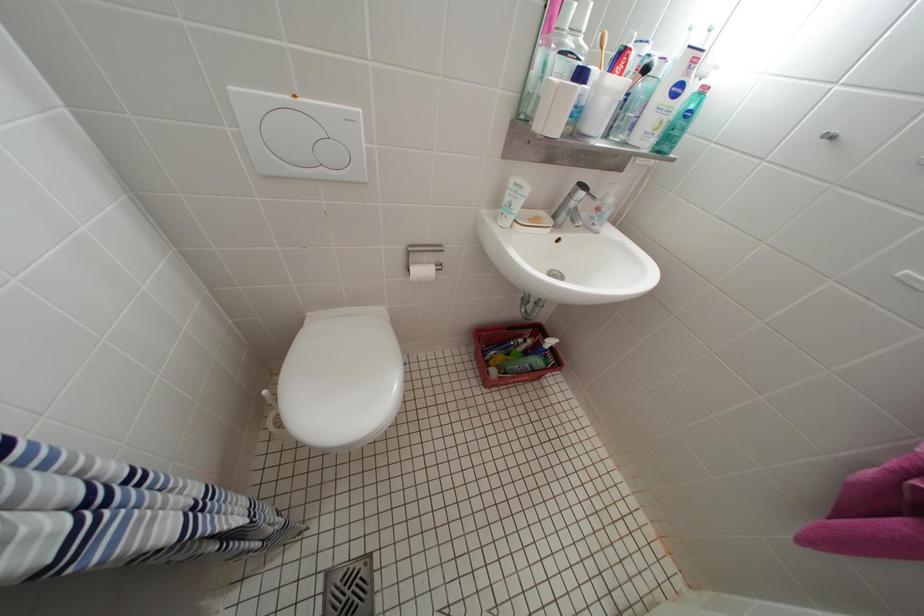
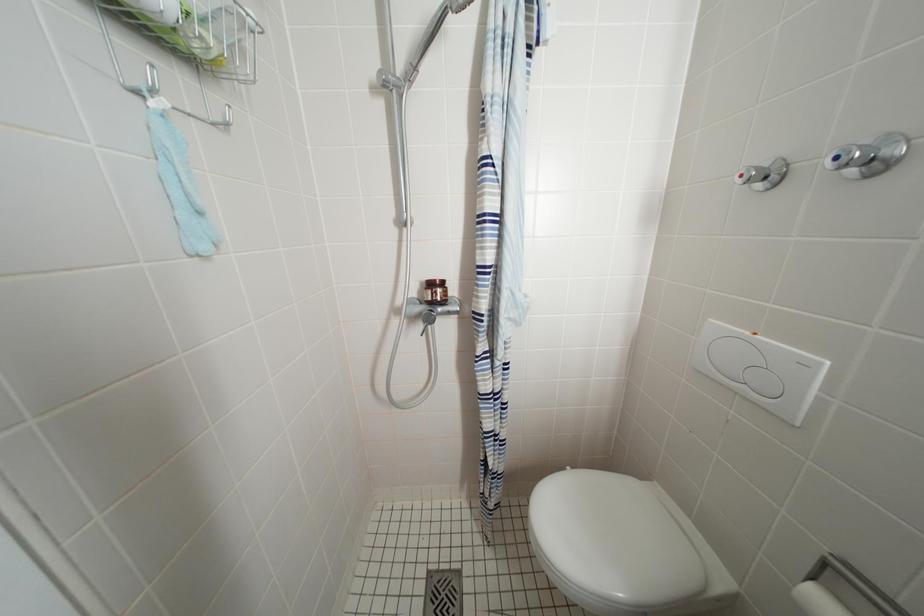
The first image is from the beginning of the video and the second image is from the end. How did the camera likely rotate when shooting the video?

The camera rotated toward left-down.